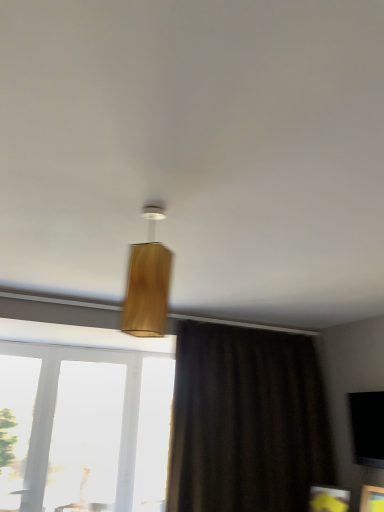
What do you see at coordinates (96, 428) in the screenshot? I see `transparent glass window at lower left, the second window positioned from the left` at bounding box center [96, 428].

Find the location of a particular element. transparent glass window screen at lower right is located at coordinates (367, 426).

What do you see at coordinates (86, 437) in the screenshot? I see `transparent glass window at left, the third window positioned from the left` at bounding box center [86, 437].

This screenshot has height=512, width=384. What do you see at coordinates (16, 423) in the screenshot?
I see `transparent glass window at lower left, the 1th window from the left` at bounding box center [16, 423].

Identify the location of transparent glass window at lower left, which is the second window in right-to-left order. The width and height of the screenshot is (384, 512). point(96,428).

Who is more distant, wooden lampshade at center or transparent glass window at left, placed as the 1th window when sorted from right to left?

transparent glass window at left, placed as the 1th window when sorted from right to left, is further away from the camera.

Based on their sizes in the image, would you say wooden lampshade at center is bigger or smaller than transparent glass window at left, the third window positioned from the left?

wooden lampshade at center is smaller than transparent glass window at left, the third window positioned from the left.

From the image's perspective, would you say wooden lampshade at center is shown under transparent glass window at left, the third window positioned from the left?

Incorrect, from the image's perspective, wooden lampshade at center is higher than transparent glass window at left, the third window positioned from the left.

Which object is positioned more to the left, wooden lampshade at center or transparent glass window at left, placed as the 1th window when sorted from right to left?

Positioned to the left is transparent glass window at left, placed as the 1th window when sorted from right to left.

Who is smaller, transparent glass window at left, placed as the 1th window when sorted from right to left, or transparent glass window at lower left, which is the second window in right-to-left order?

transparent glass window at left, placed as the 1th window when sorted from right to left.

From the image's perspective, which is above, transparent glass window at left, the third window positioned from the left, or transparent glass window at lower left, which is the second window in right-to-left order?

transparent glass window at lower left, which is the second window in right-to-left order, is shown above in the image.

In the scene shown: From a real-world perspective, is transparent glass window at left, placed as the 1th window when sorted from right to left, positioned over transparent glass window at lower left, which is the second window in right-to-left order, based on gravity?

Actually, transparent glass window at left, placed as the 1th window when sorted from right to left, is physically below transparent glass window at lower left, which is the second window in right-to-left order, in the real world.

Is transparent glass window at left, the third window positioned from the left, at the right side of transparent glass window at lower left, the second window positioned from the left?

Yes, transparent glass window at left, the third window positioned from the left, is to the right of transparent glass window at lower left, the second window positioned from the left.

From their relative heights in the image, would you say transparent glass window at left, the third window positioned from the left, is taller or shorter than transparent glass window at lower left, marked as the third window in a right-to-left arrangement?

Clearly, transparent glass window at left, the third window positioned from the left, is taller compared to transparent glass window at lower left, marked as the third window in a right-to-left arrangement.

From the image's perspective, is transparent glass window at left, the third window positioned from the left, above or below transparent glass window at lower left, the 1th window from the left?

From the image's perspective, transparent glass window at left, the third window positioned from the left, appears below transparent glass window at lower left, the 1th window from the left.

Does point (66, 405) come farther from viewer compared to point (26, 369)?

Yes, it is.

Is transparent glass window at left, the third window positioned from the left, wider or thinner than transparent glass window at lower left, the 1th window from the left?

Clearly, transparent glass window at left, the third window positioned from the left, has less width compared to transparent glass window at lower left, the 1th window from the left.

Does point (366, 432) appear closer or farther from the camera than point (111, 493)?

Point (366, 432) is closer to the camera than point (111, 493).

Is transparent glass window screen at lower right smaller than transparent glass window at lower left, which is the second window in right-to-left order?

Correct, transparent glass window screen at lower right occupies less space than transparent glass window at lower left, which is the second window in right-to-left order.

Between transparent glass window screen at lower right and transparent glass window at lower left, which is the second window in right-to-left order, which one appears on the right side from the viewer's perspective?

transparent glass window screen at lower right is more to the right.

How many degrees apart are the facing directions of transparent glass window screen at lower right and transparent glass window at lower left, which is the second window in right-to-left order?

They differ by 89.6 degrees in their facing directions.

Can we say transparent glass window at lower left, marked as the third window in a right-to-left arrangement, lies outside transparent glass window screen at lower right?

Yes, transparent glass window at lower left, marked as the third window in a right-to-left arrangement, is located beyond the bounds of transparent glass window screen at lower right.

Is transparent glass window at lower left, the 1th window from the left, positioned far away from transparent glass window screen at lower right?

Yes.

Considering the sizes of objects transparent glass window at lower left, marked as the third window in a right-to-left arrangement, and transparent glass window screen at lower right in the image provided, who is smaller, transparent glass window at lower left, marked as the third window in a right-to-left arrangement, or transparent glass window screen at lower right?

transparent glass window screen at lower right.

From the image's perspective, does transparent glass window at lower left, marked as the third window in a right-to-left arrangement, appear lower than transparent glass window screen at lower right?

Yes, from the image's perspective, transparent glass window at lower left, marked as the third window in a right-to-left arrangement, is below transparent glass window screen at lower right.

Is point (153, 259) closer to camera compared to point (381, 449)?

Yes, point (153, 259) is in front of point (381, 449).

Is wooden lampshade at center not close to transparent glass window screen at lower right?

That's right, there is a large distance between wooden lampshade at center and transparent glass window screen at lower right.

Can you confirm if wooden lampshade at center is bigger than transparent glass window screen at lower right?

No.

Can you confirm if brown matte curtain at lower right is wider than transparent glass window screen at lower right?

Indeed, brown matte curtain at lower right has a greater width compared to transparent glass window screen at lower right.

Is point (253, 426) positioned behind point (377, 459)?

Yes.

The image size is (384, 512). I want to click on curtain that is in front of the transparent glass window screen at lower right, so click(x=246, y=421).

Who is bigger, brown matte curtain at lower right or transparent glass window screen at lower right?

brown matte curtain at lower right is bigger.

The image size is (384, 512). There is a transparent glass window at left, placed as the 1th window when sorted from right to left. In order to click on lamp above it (from a real-world perspective) in this screenshot , I will do `click(147, 282)`.

Locate an element on the screen. The width and height of the screenshot is (384, 512). window on the right of transparent glass window at lower left, the second window positioned from the left is located at coordinates (86, 437).

Looking at the image, which one is located further to brown matte curtain at lower right, transparent glass window at lower left, the 1th window from the left, or wooden lampshade at center?

Among the two, wooden lampshade at center is located further to brown matte curtain at lower right.

In the scene shown: Based on their spatial positions, is transparent glass window screen at lower right or brown matte curtain at lower right further from transparent glass window at lower left, marked as the third window in a right-to-left arrangement?

Based on the image, transparent glass window screen at lower right appears to be further to transparent glass window at lower left, marked as the third window in a right-to-left arrangement.

In the scene shown: Which object lies nearer to the anchor point transparent glass window at lower left, the second window positioned from the left, transparent glass window at lower left, the 1th window from the left, or brown matte curtain at lower right?

Among the two, transparent glass window at lower left, the 1th window from the left, is located nearer to transparent glass window at lower left, the second window positioned from the left.

Based on their spatial positions, is transparent glass window screen at lower right or transparent glass window at lower left, which is the second window in right-to-left order, closer to wooden lampshade at center?

Among the two, transparent glass window screen at lower right is located nearer to wooden lampshade at center.

From the image, which object appears to be nearer to transparent glass window at lower left, marked as the third window in a right-to-left arrangement, transparent glass window screen at lower right or transparent glass window at left, placed as the 1th window when sorted from right to left?

transparent glass window at left, placed as the 1th window when sorted from right to left.

Estimate the real-world distances between objects in this image. Which object is closer to transparent glass window at lower left, the second window positioned from the left, transparent glass window at lower left, the 1th window from the left, or transparent glass window at left, placed as the 1th window when sorted from right to left?

Among the two, transparent glass window at lower left, the 1th window from the left, is located nearer to transparent glass window at lower left, the second window positioned from the left.

Estimate the real-world distances between objects in this image. Which object is closer to transparent glass window screen at lower right, wooden lampshade at center or transparent glass window at lower left, marked as the third window in a right-to-left arrangement?

Based on the image, wooden lampshade at center appears to be nearer to transparent glass window screen at lower right.

Which object lies further to the anchor point wooden lampshade at center, transparent glass window screen at lower right or transparent glass window at lower left, the 1th window from the left?

The object further to wooden lampshade at center is transparent glass window at lower left, the 1th window from the left.

The width and height of the screenshot is (384, 512). Find the location of `window between transparent glass window at lower left, which is the second window in right-to-left order, and brown matte curtain at lower right, in the horizontal direction`. window between transparent glass window at lower left, which is the second window in right-to-left order, and brown matte curtain at lower right, in the horizontal direction is located at coordinates [86, 437].

I want to click on curtain between wooden lampshade at center and transparent glass window screen at lower right from front to back, so click(x=246, y=421).

Where is `lamp between transparent glass window at lower left, marked as the third window in a right-to-left arrangement, and brown matte curtain at lower right, in the horizontal direction`? lamp between transparent glass window at lower left, marked as the third window in a right-to-left arrangement, and brown matte curtain at lower right, in the horizontal direction is located at coordinates (147, 282).

Identify the location of lamp between transparent glass window at lower left, which is the second window in right-to-left order, and transparent glass window screen at lower right. This screenshot has height=512, width=384. 147,282.